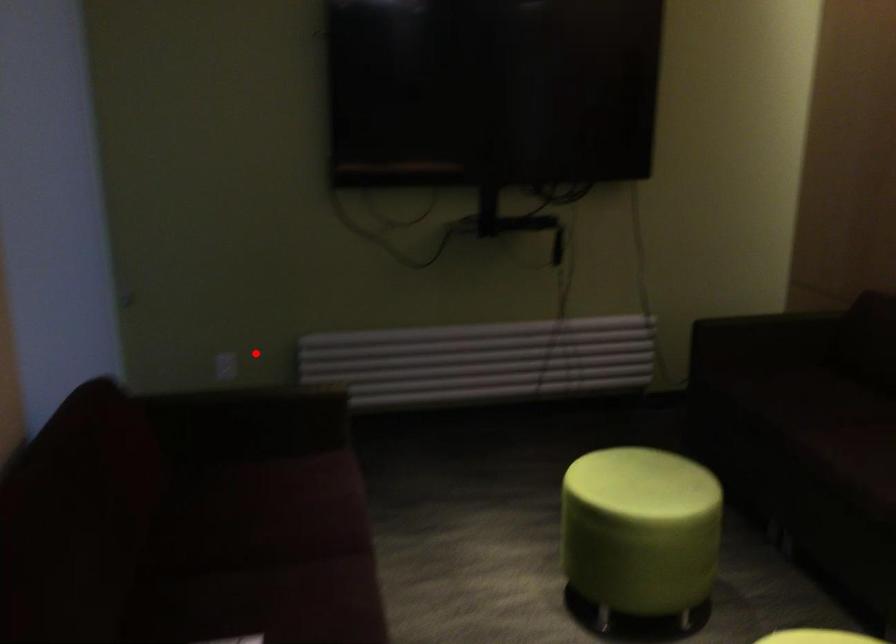
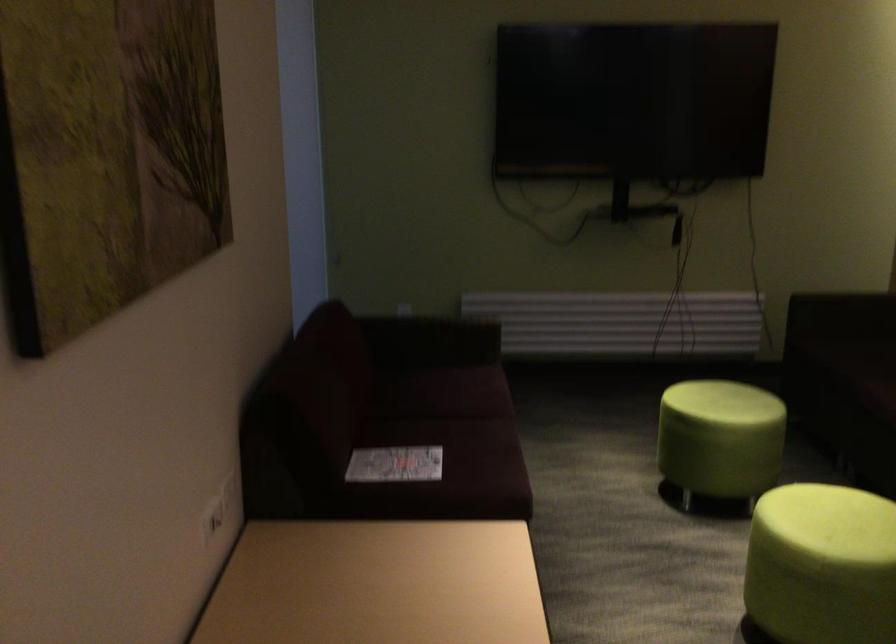
Find the pixel in the second image that matches the highlighted location in the first image.

(437, 303)